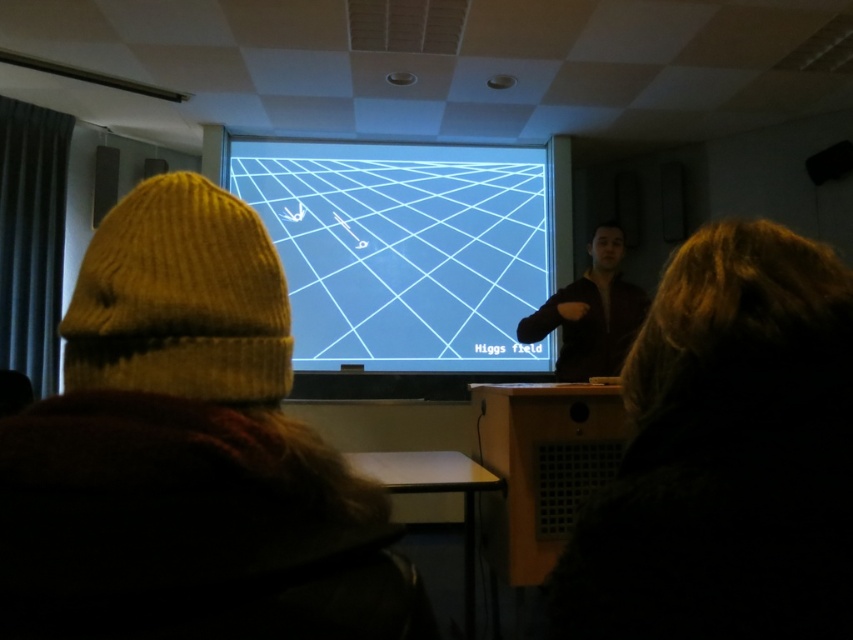
Question: Which of the following is the closest to the observer?

Choices:
 (A) (560, 291)
 (B) (795, 269)

Answer: (B)

Question: Does dark brown fur coat at right appear on the right side of dark brown leather jacket at center?

Choices:
 (A) yes
 (B) no

Answer: (B)

Question: Which point is closer to the camera?

Choices:
 (A) dark brown fur coat at right
 (B) dark brown leather jacket at center
 (C) white grid at center

Answer: (A)

Question: Which point is closer to the camera?

Choices:
 (A) (814, 621)
 (B) (556, 296)

Answer: (A)

Question: Can you confirm if white grid at center is thinner than dark brown leather jacket at center?

Choices:
 (A) yes
 (B) no

Answer: (B)

Question: Does dark brown fur coat at right appear over dark brown leather jacket at center?

Choices:
 (A) no
 (B) yes

Answer: (A)